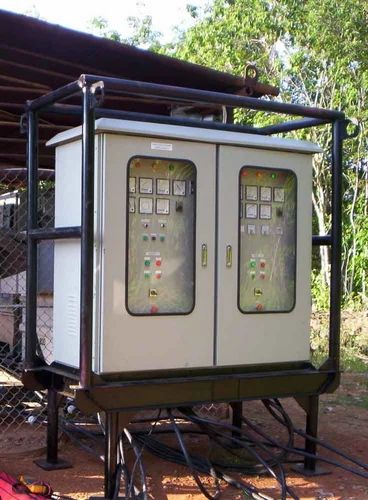
You are a GUI agent. You are given a task and a screenshot of the screen. Output one action in this format:
    pyautogui.click(x=<x>, y=<y>)
    Task: Click on the green lights
    Image resolution: width=368 pixels, height=500 pixels.
    Given the screenshot: What is the action you would take?
    pyautogui.click(x=250, y=264), pyautogui.click(x=252, y=277), pyautogui.click(x=145, y=263), pyautogui.click(x=146, y=274), pyautogui.click(x=144, y=239), pyautogui.click(x=163, y=240), pyautogui.click(x=275, y=176), pyautogui.click(x=172, y=166)